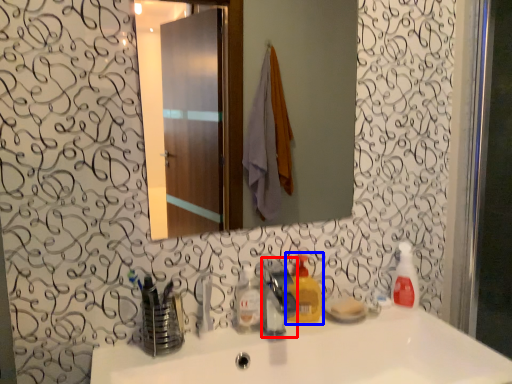
Question: Which object appears closest to the camera in this image, faucet (highlighted by a red box) or cleaning product (highlighted by a blue box)?

Choices:
 (A) faucet
 (B) cleaning product

Answer: (A)